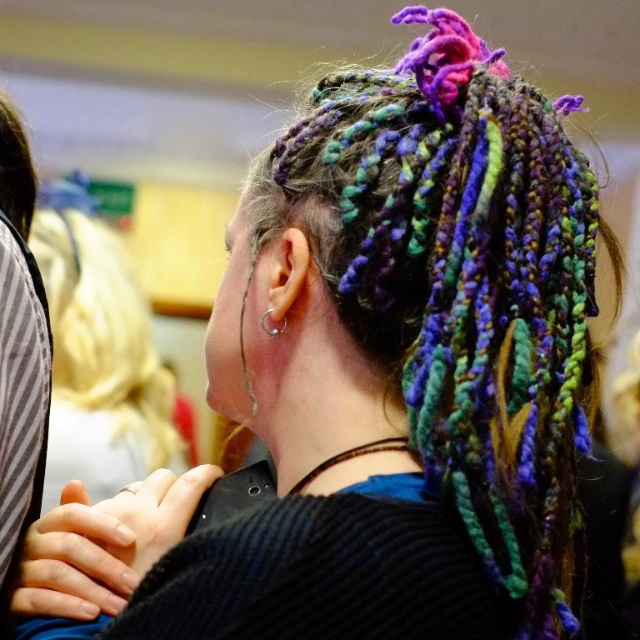
Is point (84, 250) closer to viewer compared to point (275, 328)?

No, (84, 250) is behind (275, 328).

Is multicolored braids at upper center in front of silver metallic ring at ear?

No, multicolored braids at upper center is further to the viewer.

Which is in front, point (112, 364) or point (282, 321)?

Point (282, 321) is more forward.

Find the location of `multicolored braids at upper center`. multicolored braids at upper center is located at coordinates (104, 333).